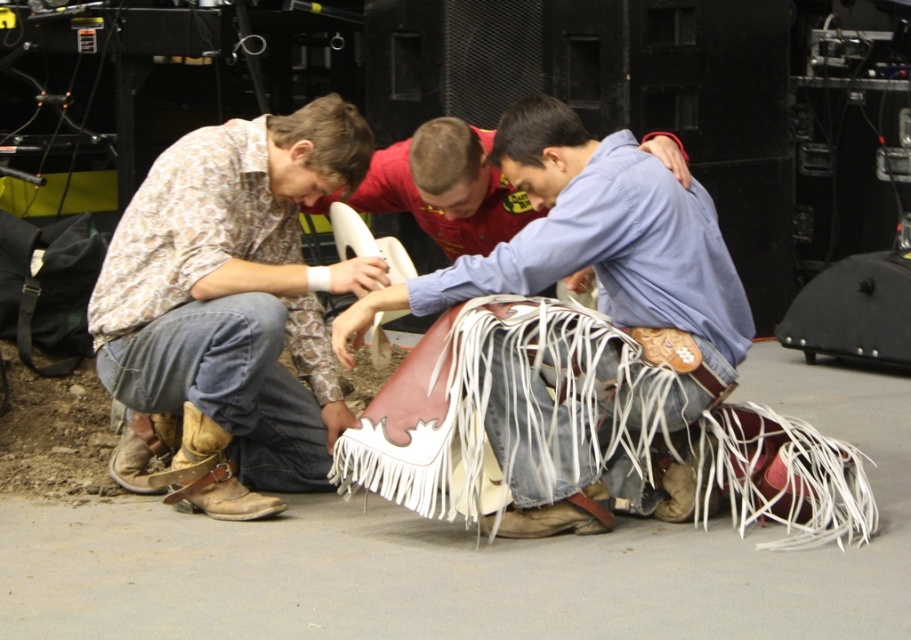
You are directing a stage play and need to position two markers on the stage floor. The first marker must be placed at point (695, 326) and the second at point (197, 452). From the audience perspective, which marker will appear closer to the front of the stage?

The point at (695, 326) will appear closer to the front of the stage because it is in front of point (197, 452) from the audience perspective.

Based on the scene description, can you determine which object has a greater width between the leather fringe skirt at center and the brown leather cowboy boot at lower left?

The leather fringe skirt at center has a greater width than the brown leather cowboy boot at lower left according to the description.